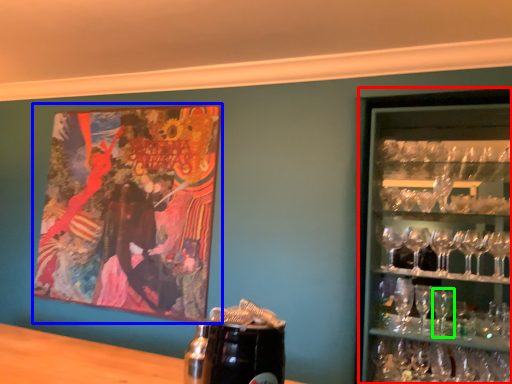
Question: Which object is positioned closest to shelf (highlighted by a red box)? Select from picture frame (highlighted by a blue box) and martini glass (highlighted by a green box).

Choices:
 (A) picture frame
 (B) martini glass

Answer: (B)